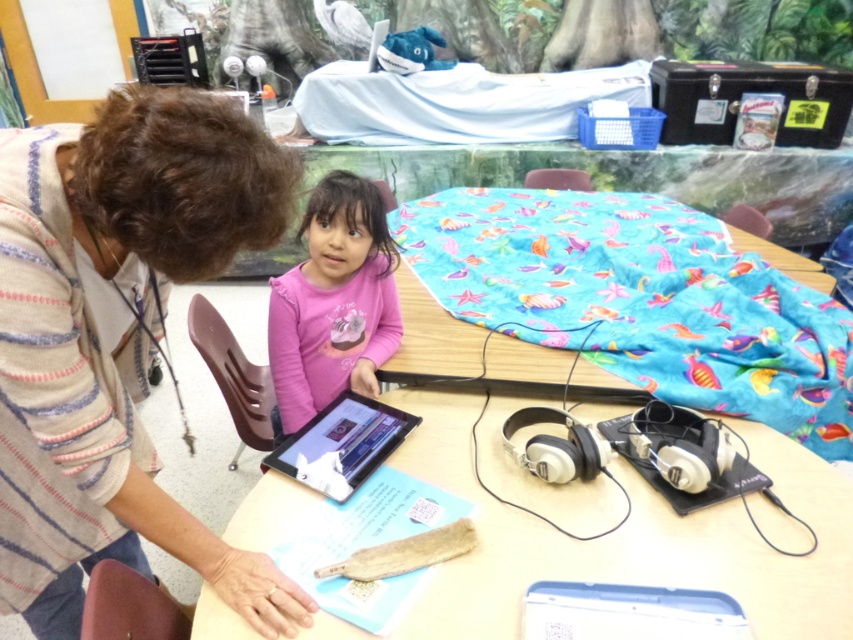
Question: In this image, where is striped sweater at upper left located relative to pink matte shirt at center?

Choices:
 (A) above
 (B) below

Answer: (B)

Question: Which point appears closest to the camera in this image?

Choices:
 (A) (219, 186)
 (B) (386, 413)
 (C) (746, 234)
 (D) (204, 630)

Answer: (A)

Question: Which point is closer to the camera?

Choices:
 (A) (664, 292)
 (B) (343, 250)

Answer: (B)

Question: Which point appears closest to the camera in this image?

Choices:
 (A) (532, 262)
 (B) (361, 353)
 (C) (148, 136)
 (D) (810, 609)

Answer: (C)

Question: Does striped sweater at upper left appear under black glossy tablet at center?

Choices:
 (A) no
 (B) yes

Answer: (A)

Question: Does striped sweater at upper left come behind pink matte shirt at center?

Choices:
 (A) yes
 (B) no

Answer: (B)